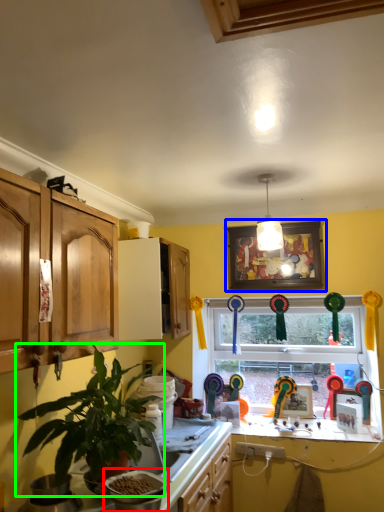
Question: Considering the real-world distances, which object is farthest from appliance (highlighted by a red box)? picture frame (highlighted by a blue box) or houseplant (highlighted by a green box)?

Choices:
 (A) picture frame
 (B) houseplant

Answer: (A)